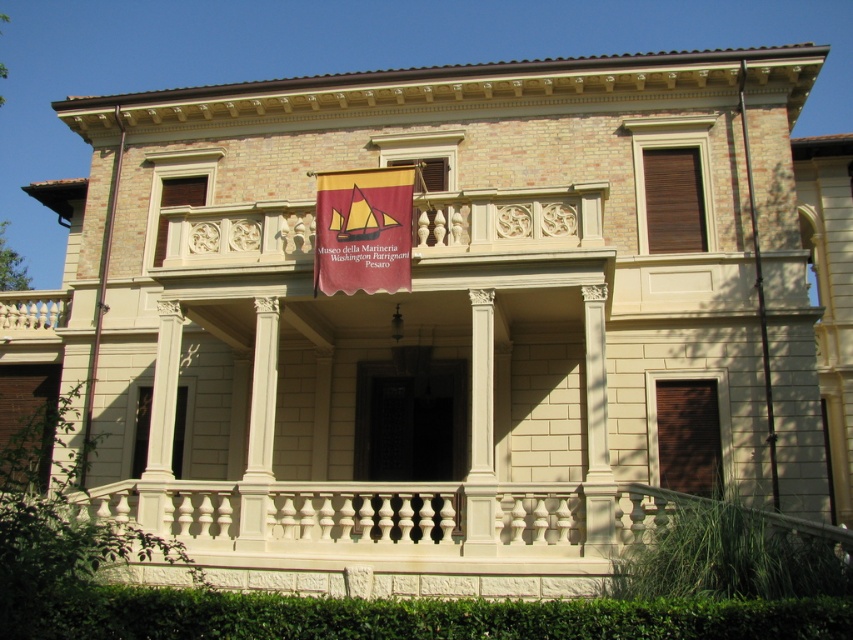
You are an architect assessing the building facade. The white stone balcony at center and the maroon fabric banner at center are both central to the design. Which object has a greater height measurement?

The maroon fabric banner at center is taller than the white stone balcony at center, so the banner has a greater height measurement.

You are an architect visiting the Museo della Marineria Washington Patrignani Pesaro. You notice the white stone balcony at center and the maroon fabric banner at center. Which object is larger in size?

The maroon fabric banner at center is larger in size compared to the white stone balcony at center.